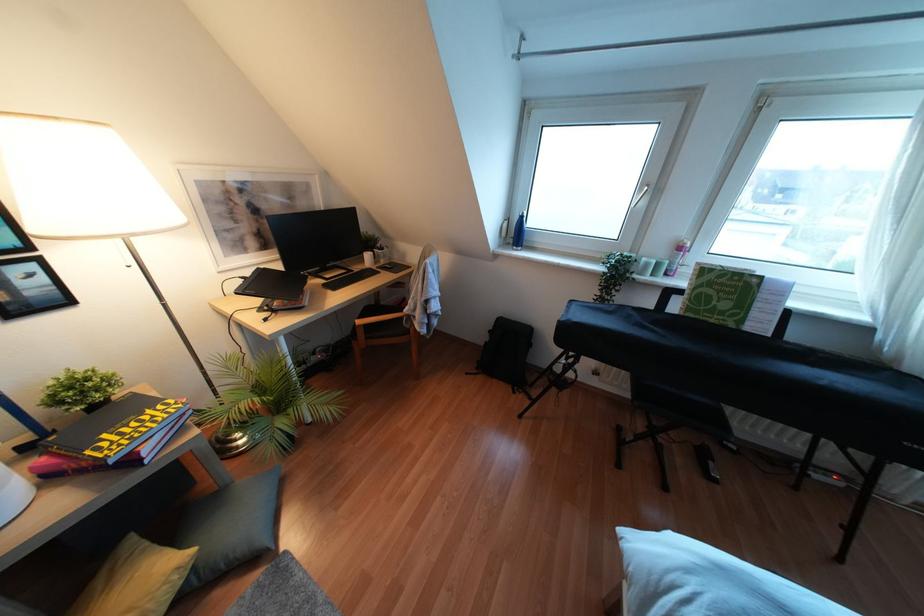
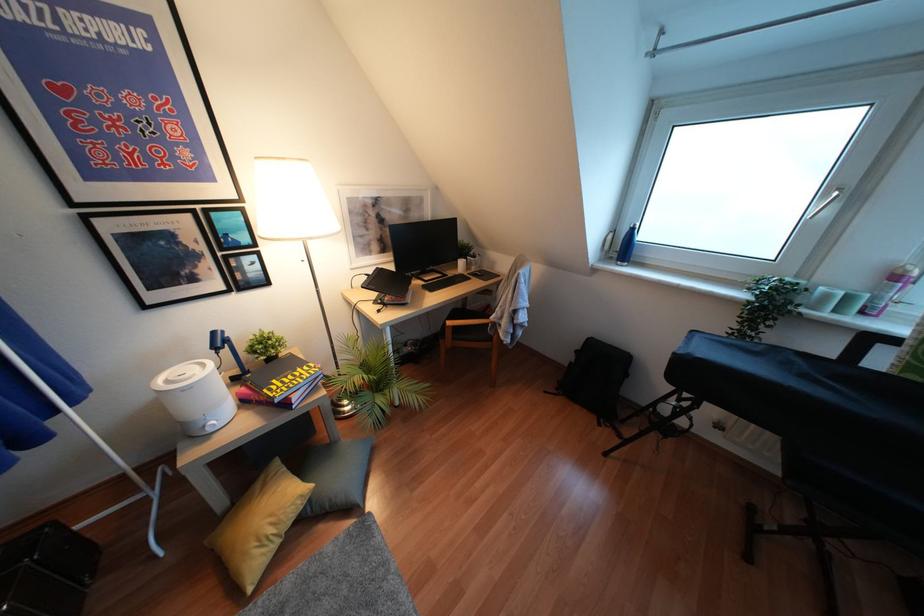
Find the pixel in the second image that matches pixel 112 461 in the first image.

(275, 400)